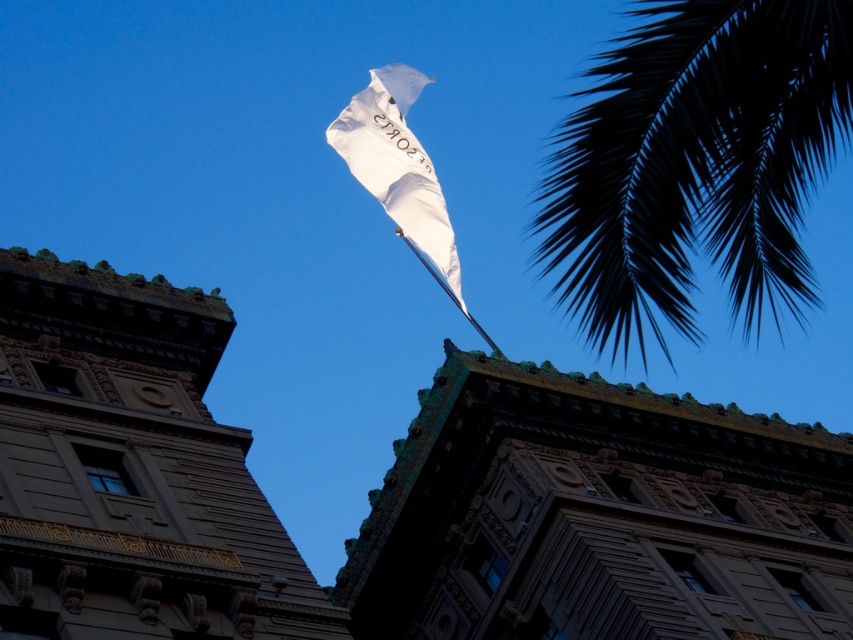
Question: Which of the following is the farthest from the observer?

Choices:
 (A) white fabric flag at upper center
 (B) gold textured stone tower at center

Answer: (A)

Question: In this image, where is dark green leafy palm at upper right located relative to white fabric flag at center?

Choices:
 (A) left
 (B) right

Answer: (B)

Question: Can you confirm if dark green leafy palm at upper right is positioned below white fabric flag at center?

Choices:
 (A) yes
 (B) no

Answer: (B)

Question: Which point is closer to the camera?

Choices:
 (A) dark green leafy palm at upper right
 (B) gold textured stone tower at center
 (C) white fabric flag at center
 (D) green textured roof at center

Answer: (A)

Question: Among these objects, which one is nearest to the camera?

Choices:
 (A) white fabric flag at center
 (B) dark green leafy palm at upper right
 (C) green textured roof at center

Answer: (B)

Question: Does white fabric flag at upper center come in front of white fabric flag at center?

Choices:
 (A) no
 (B) yes

Answer: (A)